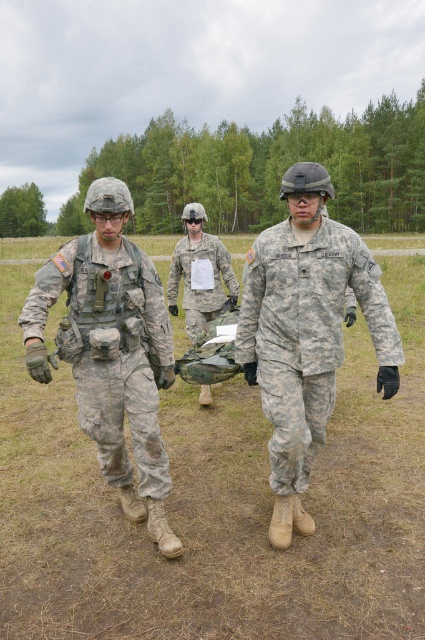
Question: Is camouflage uniform at center positioned at the back of camouflage uniform at left?

Choices:
 (A) no
 (B) yes

Answer: (B)

Question: Is camouflage uniform at center to the left of camouflage uniform at left from the viewer's perspective?

Choices:
 (A) no
 (B) yes

Answer: (A)

Question: Which point is farther to the camera?

Choices:
 (A) camouflage uniform at center
 (B) camouflage uniform at left
 (C) camouflage fabric bag at center

Answer: (C)

Question: Considering the real-world distances, which object is farthest from the camouflage uniform at left?

Choices:
 (A) camouflage fabric bag at center
 (B) camouflage uniform at center

Answer: (A)

Question: Does camouflage uniform at center appear on the right side of camouflage uniform at left?

Choices:
 (A) yes
 (B) no

Answer: (A)

Question: Which of the following is the closest to the observer?

Choices:
 (A) (178, 248)
 (B) (289, 397)
 (C) (65, 273)

Answer: (C)